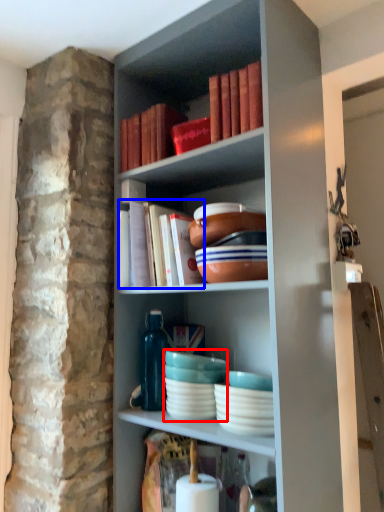
Question: Which of the following is the closest to the observer, tableware (highlighted by a red box) or book (highlighted by a blue box)?

Choices:
 (A) tableware
 (B) book

Answer: (B)